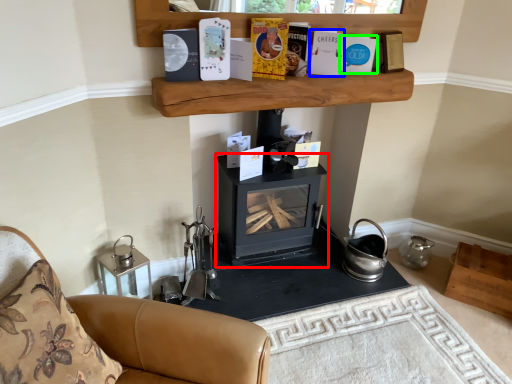
Question: Which object is positioned farthest from wood burning stove (highlighted by a red box)? Select from paperback book (highlighted by a blue box) and paperback book (highlighted by a green box).

Choices:
 (A) paperback book
 (B) paperback book

Answer: (B)